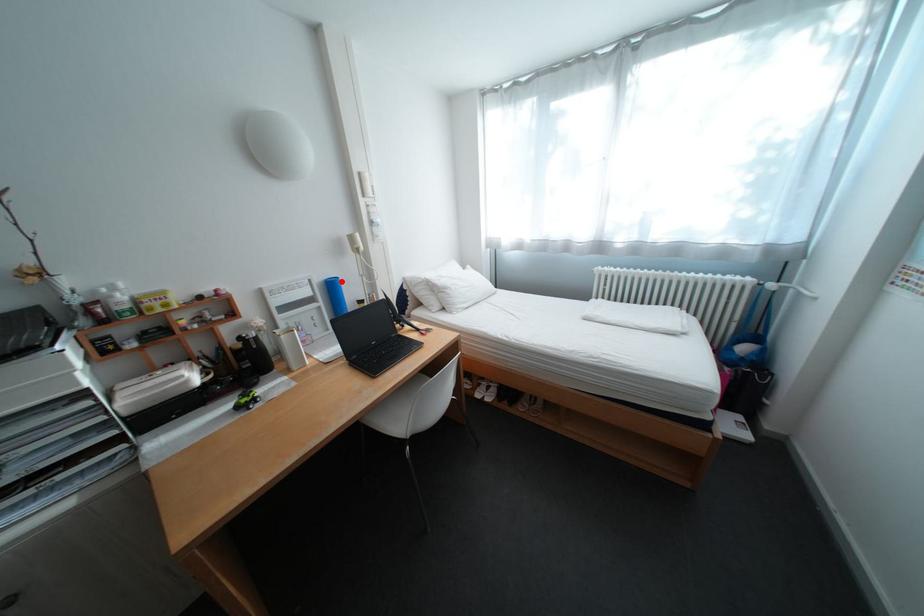
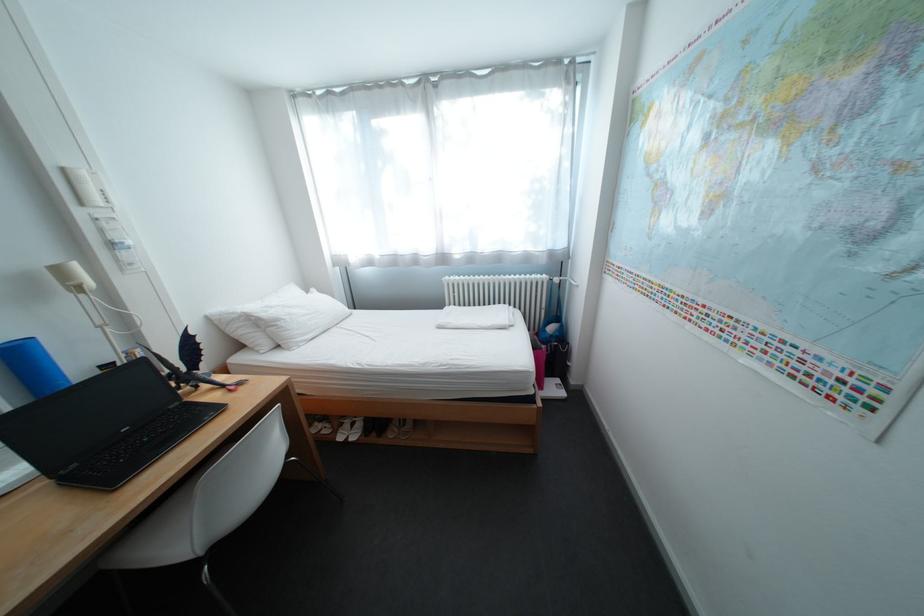
Question: I am providing you with two images of the same scene from different viewpoints. Image1 has a red point marked. In image2, the corresponding 3D location appears at what relative position? Reply with the corresponding letter.

Choices:
 (A) Closer
 (B) Farther

Answer: (B)